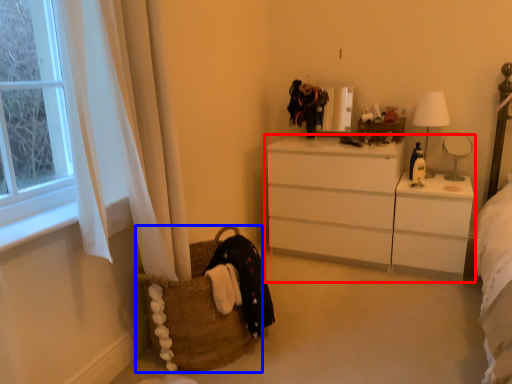
Question: Among these objects, which one is nearest to the camera, chest of drawers (highlighted by a red box) or picnic basket (highlighted by a blue box)?

Choices:
 (A) chest of drawers
 (B) picnic basket

Answer: (B)